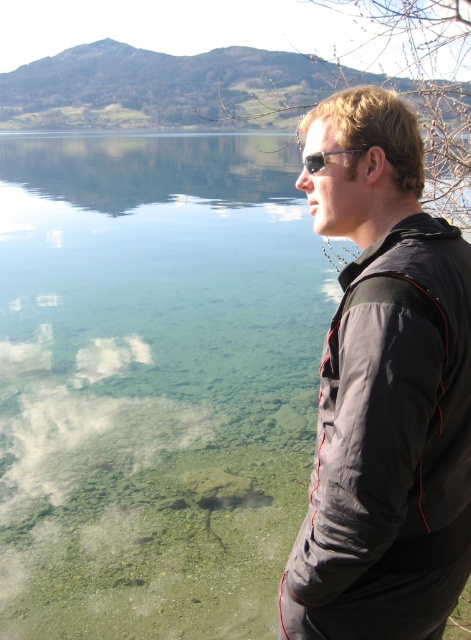
You are a photographer planning to take a picture of the dark gray jacket at right. The coordinates given are point (383,392). Can you confirm if this point aligns with the location of the jacket?

Yes, the point (383,392) corresponds to the dark gray jacket at right, so the coordinates align with its location.

You are a fashion designer analyzing the image. You need to determine if the dark gray jacket at right can be paired with the sunglasses at center based on their sizes. Can the jacket accommodate the sunglasses when worn together?

The dark gray jacket at right is wider than the sunglasses at center, so yes, the jacket can accommodate the sunglasses when worn together since its width surpasses that of the sunglasses.